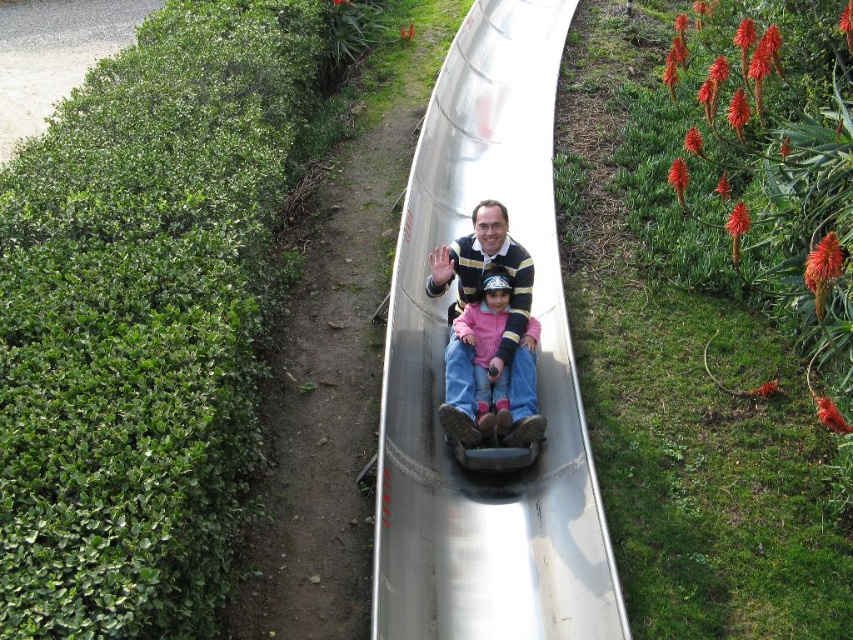
Question: Considering the real-world distances, which object is closest to the green leafy hedge at left?

Choices:
 (A) matte pink sweater at center
 (B) metallic smooth slide at center

Answer: (A)

Question: Estimate the real-world distances between objects in this image. Which object is closer to the metallic smooth slide at center?

Choices:
 (A) matte pink sweater at center
 (B) green leafy hedge at left

Answer: (A)

Question: Can you confirm if green leafy hedge at left is positioned to the left of matte pink sweater at center?

Choices:
 (A) no
 (B) yes

Answer: (B)

Question: Considering the relative positions of green leafy hedge at left and metallic smooth slide at center in the image provided, where is green leafy hedge at left located with respect to metallic smooth slide at center?

Choices:
 (A) right
 (B) left

Answer: (B)

Question: Which object appears closest to the camera in this image?

Choices:
 (A) matte pink sweater at center
 (B) green leafy hedge at left

Answer: (B)

Question: Is green leafy hedge at left below matte pink sweater at center?

Choices:
 (A) yes
 (B) no

Answer: (A)